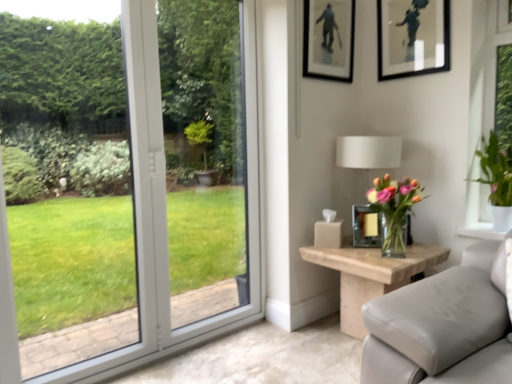
Question: Can you confirm if metallic gold picture frame at right, positioned as the 2th picture frame in right-to-left order, is positioned to the left of green leafy plant at right, arranged as the second houseplant when viewed from the left?

Choices:
 (A) yes
 (B) no

Answer: (A)

Question: Does metallic gold picture frame at right, positioned as the 2th picture frame in right-to-left order, have a greater width compared to green leafy plant at right, which is the first houseplant in right-to-left order?

Choices:
 (A) yes
 (B) no

Answer: (B)

Question: Is the surface of metallic gold picture frame at right, which ranks as the 1th picture frame in bottom-to-top order, in direct contact with green leafy plant at right, which is the first houseplant in right-to-left order?

Choices:
 (A) no
 (B) yes

Answer: (A)

Question: Does metallic gold picture frame at right, which is counted as the third picture frame, starting from the top, have a greater height compared to green leafy plant at right, arranged as the second houseplant when viewed from the left?

Choices:
 (A) no
 (B) yes

Answer: (A)

Question: From a real-world perspective, is metallic gold picture frame at right, the second picture frame from the left, under green leafy plant at right, which is the first houseplant in right-to-left order?

Choices:
 (A) yes
 (B) no

Answer: (A)

Question: Can you confirm if metallic gold picture frame at right, positioned as the 2th picture frame in right-to-left order, is thinner than green leafy plant at right, arranged as the second houseplant when viewed from the left?

Choices:
 (A) yes
 (B) no

Answer: (A)

Question: Considering the relative sizes of green leafy plant at right, which is the first houseplant in right-to-left order, and metallic gold picture frame at right, which is counted as the third picture frame, starting from the top, in the image provided, is green leafy plant at right, which is the first houseplant in right-to-left order, smaller than metallic gold picture frame at right, which is counted as the third picture frame, starting from the top,?

Choices:
 (A) no
 (B) yes

Answer: (A)

Question: From the image's perspective, does green leafy plant at right, arranged as the second houseplant when viewed from the left, appear higher than metallic gold picture frame at right, which ranks as the 1th picture frame in bottom-to-top order?

Choices:
 (A) no
 (B) yes

Answer: (B)

Question: From a real-world perspective, does green leafy plant at right, arranged as the second houseplant when viewed from the left, stand above metallic gold picture frame at right, positioned as the 2th picture frame in right-to-left order?

Choices:
 (A) yes
 (B) no

Answer: (A)

Question: Does green leafy plant at right, arranged as the second houseplant when viewed from the left, have a greater width compared to metallic gold picture frame at right, which is counted as the third picture frame, starting from the top?

Choices:
 (A) no
 (B) yes

Answer: (B)

Question: Considering the relative sizes of green leafy plant at right, which is the first houseplant in right-to-left order, and metallic gold picture frame at right, positioned as the 2th picture frame in right-to-left order, in the image provided, is green leafy plant at right, which is the first houseplant in right-to-left order, thinner than metallic gold picture frame at right, positioned as the 2th picture frame in right-to-left order,?

Choices:
 (A) no
 (B) yes

Answer: (A)

Question: Is green leafy plant at right, arranged as the second houseplant when viewed from the left, taller than metallic gold picture frame at right, which is counted as the third picture frame, starting from the top?

Choices:
 (A) no
 (B) yes

Answer: (B)

Question: Does green leafy plant at right, arranged as the second houseplant when viewed from the left, appear on the left side of translucent glass vase at right, placed as the 1th houseplant when sorted from left to right?

Choices:
 (A) no
 (B) yes

Answer: (A)